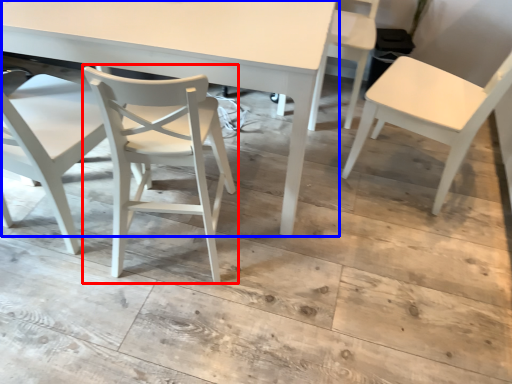
Question: Which point is closer to the camera, chair (highlighted by a red box) or table (highlighted by a blue box)?

Choices:
 (A) chair
 (B) table

Answer: (A)